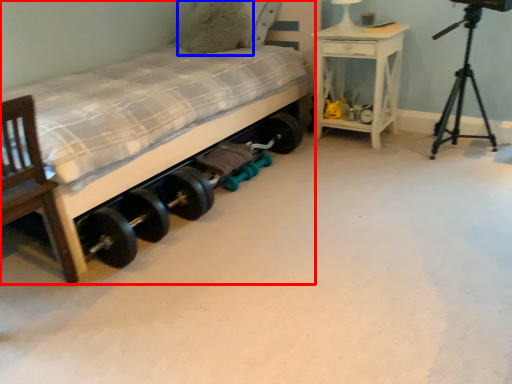
Question: Which object is closer to the camera taking this photo, bed (highlighted by a red box) or pillow (highlighted by a blue box)?

Choices:
 (A) bed
 (B) pillow

Answer: (A)